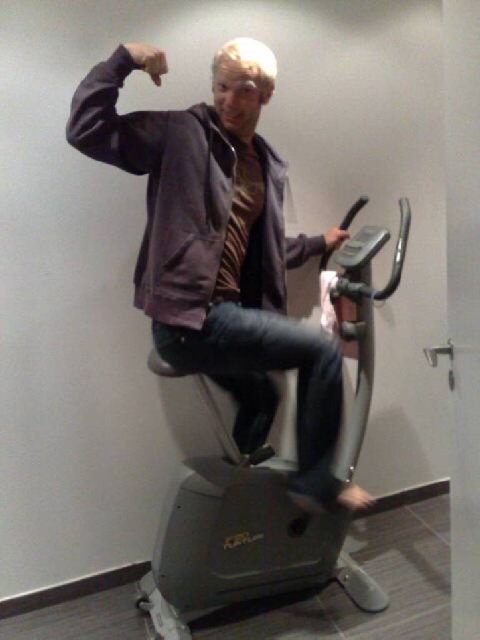
Between point (165, 131) and point (317, 580), which one is positioned in front?

Point (165, 131)

Image resolution: width=480 pixels, height=640 pixels. Describe the element at coordinates (222, 248) in the screenshot. I see `matte purple jacket at center` at that location.

Who is more distant from viewer, (307, 243) or (349, 304)?

Point (307, 243)

This screenshot has height=640, width=480. Find the location of `matte purple jacket at center`. matte purple jacket at center is located at coordinates (222, 248).